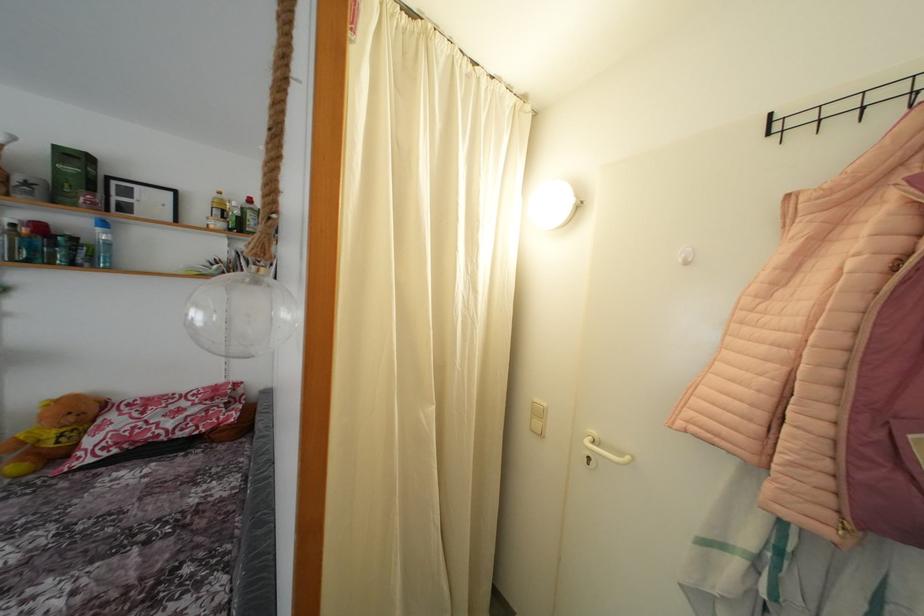
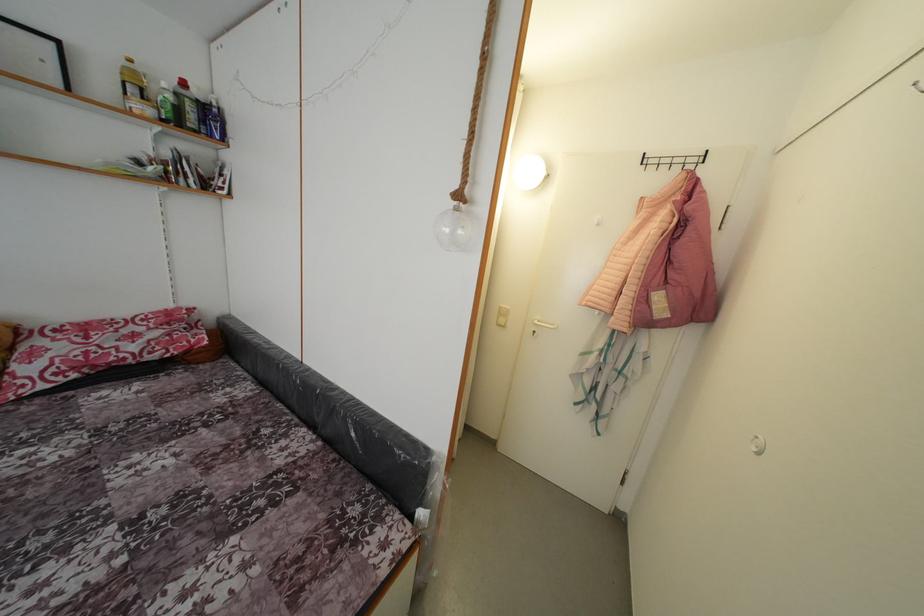
Looking at this image, what movement of the cameraman would produce the second image?

The cameraman moved toward left, backward.